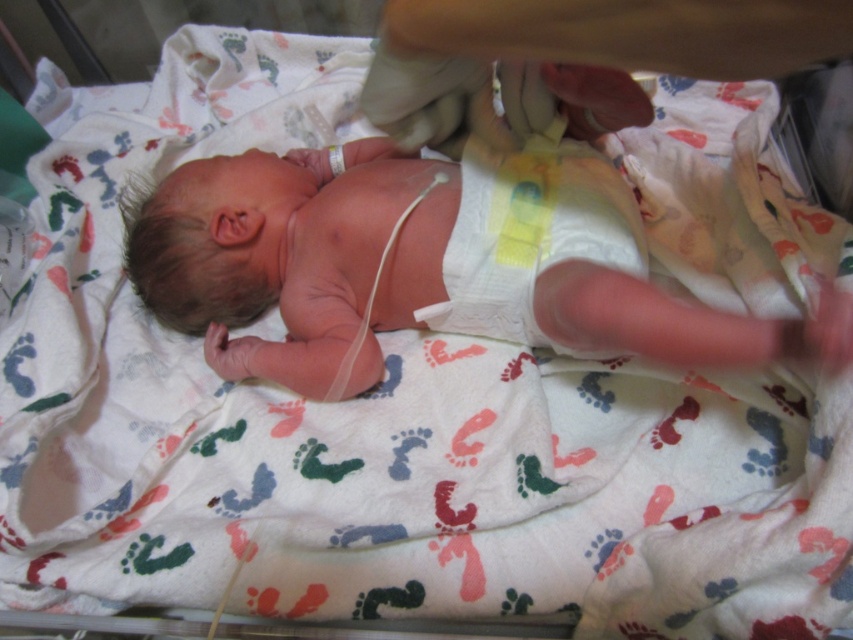
In the hospital scene, you need to place a small medical device on either the smooth skin newborn at center or the white paper diaper at center. Which one has a larger surface area to accommodate the device?

Result: The smooth skin newborn at center is bigger than the white paper diaper at center, so the device can be placed on the smooth skin newborn at center.